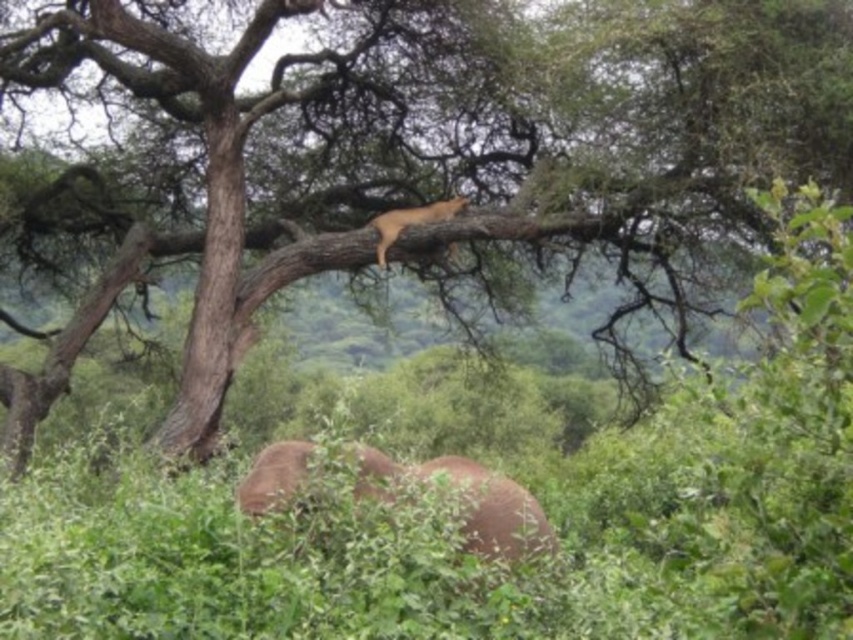
Question: Can you confirm if brown matte elephant at lower center is positioned above golden fur cat at upper center?

Choices:
 (A) no
 (B) yes

Answer: (A)

Question: Can you confirm if brown matte elephant at lower center is positioned below golden fur cat at upper center?

Choices:
 (A) no
 (B) yes

Answer: (B)

Question: Is the position of brown matte elephant at lower center less distant than that of golden fur cat at upper center?

Choices:
 (A) yes
 (B) no

Answer: (A)

Question: Which point is closer to the camera taking this photo?

Choices:
 (A) (468, 476)
 (B) (453, 196)

Answer: (A)

Question: Among these objects, which one is nearest to the camera?

Choices:
 (A) brown matte elephant at lower center
 (B) golden fur cat at upper center

Answer: (A)